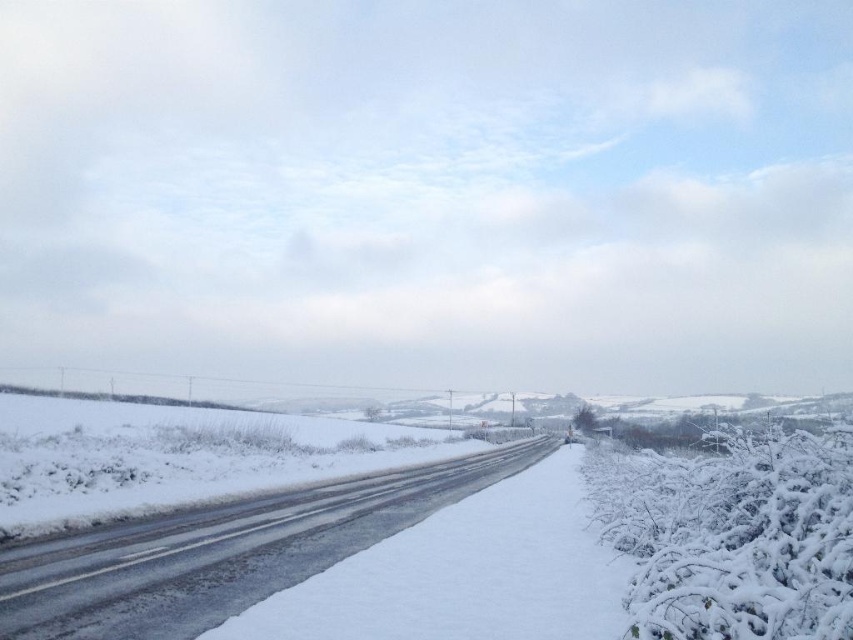
You are a snowplow driver who needs to clear the road. You notice two white frosty shrub at right and white frosty bush at right along the roadside. Which one should you avoid hitting because it is taller?

The white frosty shrub at right is taller than the white frosty bush at right, so you should avoid hitting the white frosty shrub at right to prevent damage.